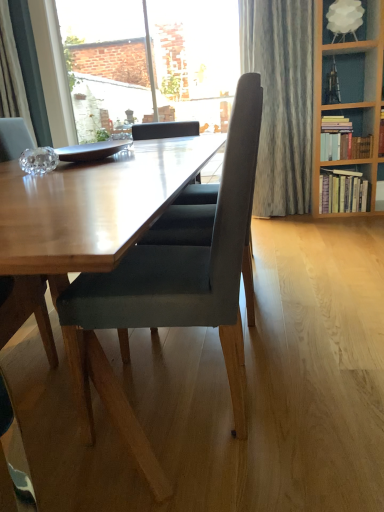
The image size is (384, 512). Identify the location of free space in front of hardcover books at right, which appears as the 2th book when viewed from the top. (347, 224).